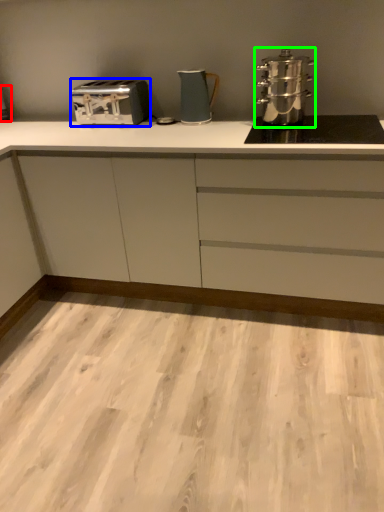
Question: Based on their relative distances, which object is farther from appliance (highlighted by a red box)? Choose from toaster (highlighted by a blue box) and kitchen appliance (highlighted by a green box).

Choices:
 (A) toaster
 (B) kitchen appliance

Answer: (B)